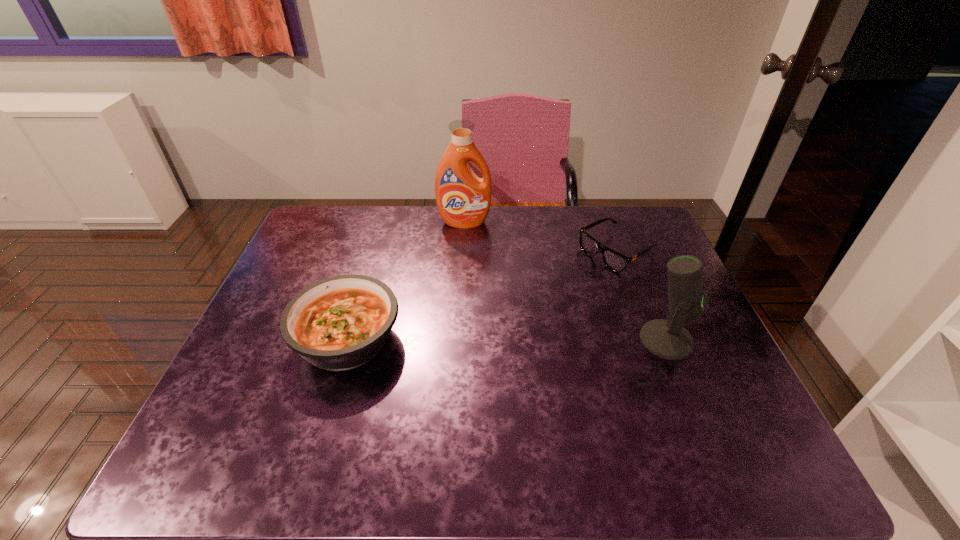
Where is `the closest object relative to the second object from left to right`? This screenshot has width=960, height=540. the closest object relative to the second object from left to right is located at coordinates [613, 260].

The height and width of the screenshot is (540, 960). I want to click on free space that satisfies the following two spatial constraints: 1. on the back side of the third tallest object; 2. on the left side of the tallest object, so click(x=382, y=222).

Locate an element on the screen. free space that satisfies the following two spatial constraints: 1. on the front side of the shortest object; 2. on the left side of the microphone is located at coordinates (650, 340).